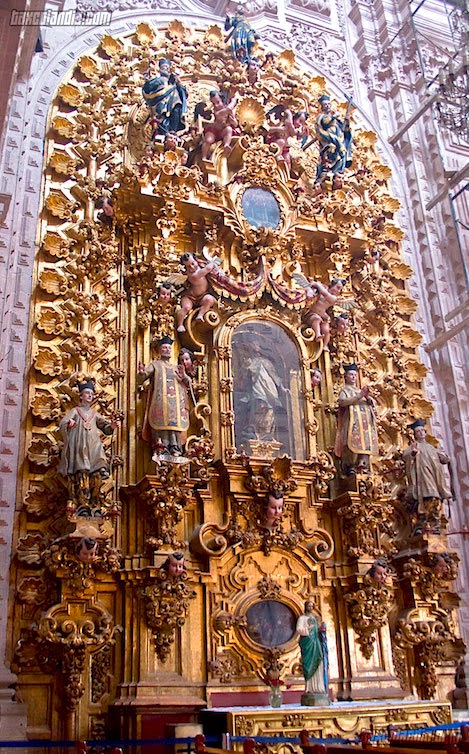
Where is `figurine`? This screenshot has width=469, height=754. figurine is located at coordinates (311, 632), (85, 420), (163, 388), (201, 282), (321, 296), (360, 417), (429, 461).